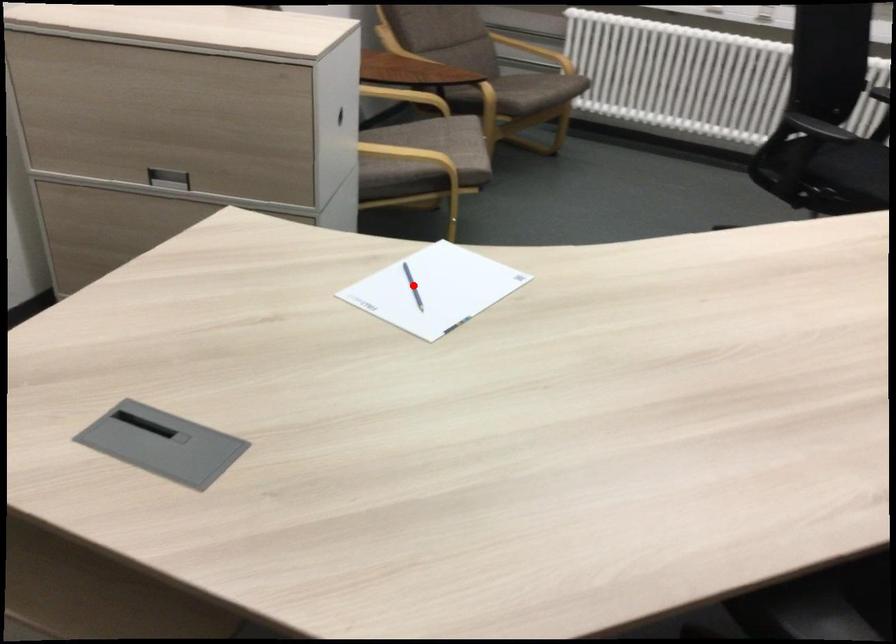
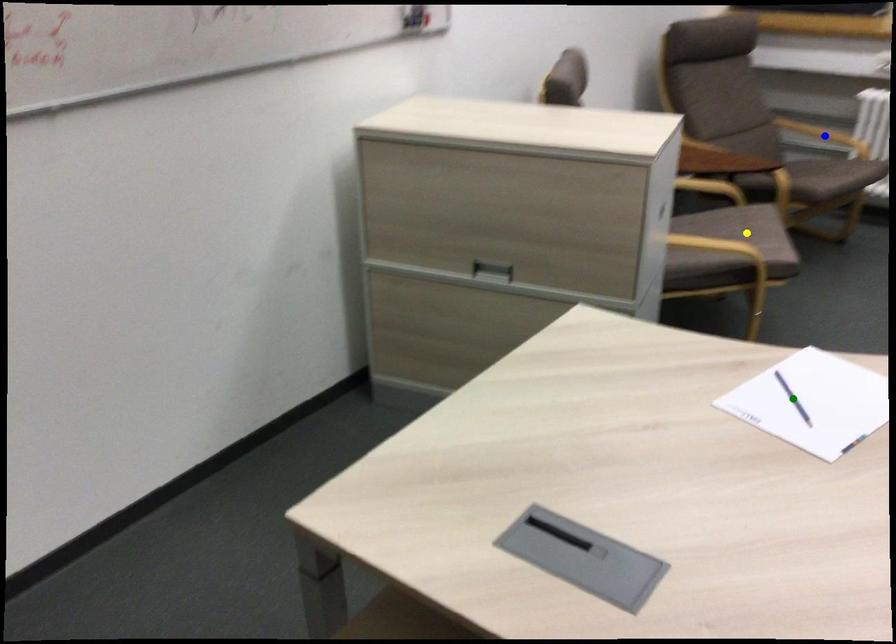
Question: I am providing you with two images of the same scene from different viewpoints. A red point is marked on the first image. You are given multiple points on the second image. Which spot in image 2 lines up with the point in image 1?

Choices:
 (A) green point
 (B) blue point
 (C) yellow point

Answer: (A)